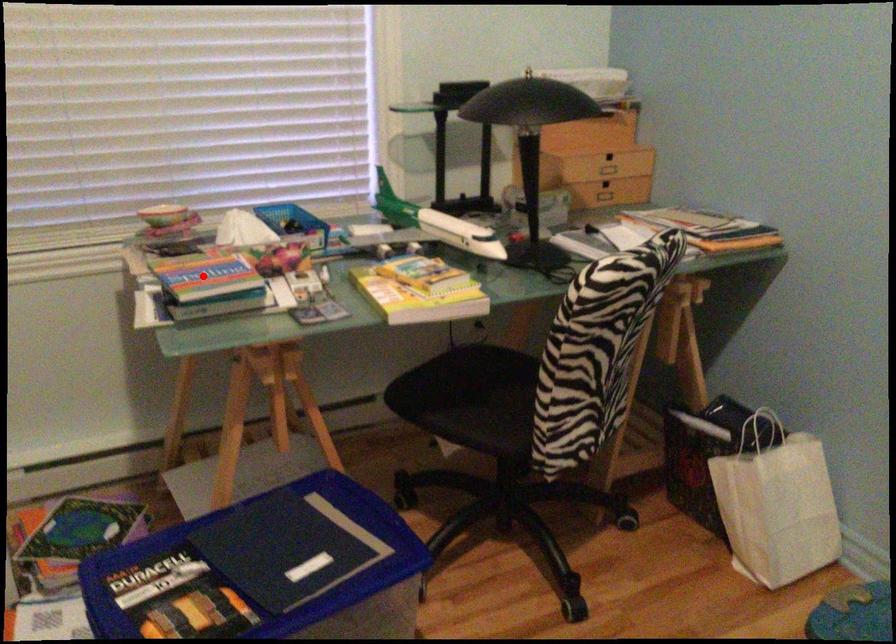
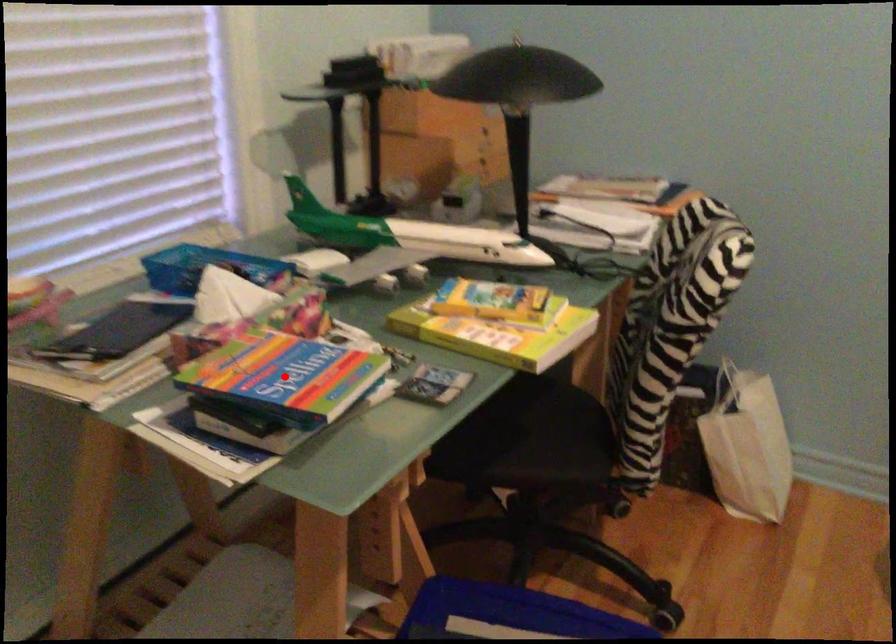
I am providing you with two images of the same scene from different viewpoints. A red point is marked on the first image and another point is marked on the second image. Does the point marked in image1 correspond to the same location as the one in image2?

Yes